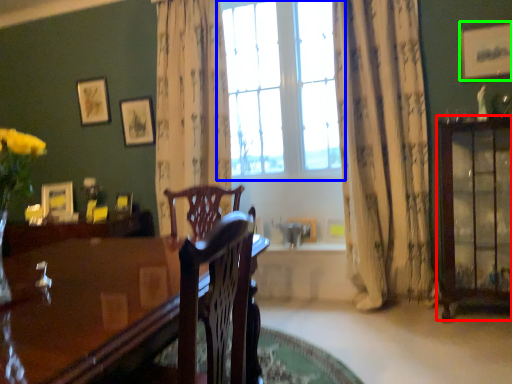
Question: Estimate the real-world distances between objects in this image. Which object is closer to cabinetry (highlighted by a red box), window (highlighted by a blue box) or picture frame (highlighted by a green box)?

Choices:
 (A) window
 (B) picture frame

Answer: (B)